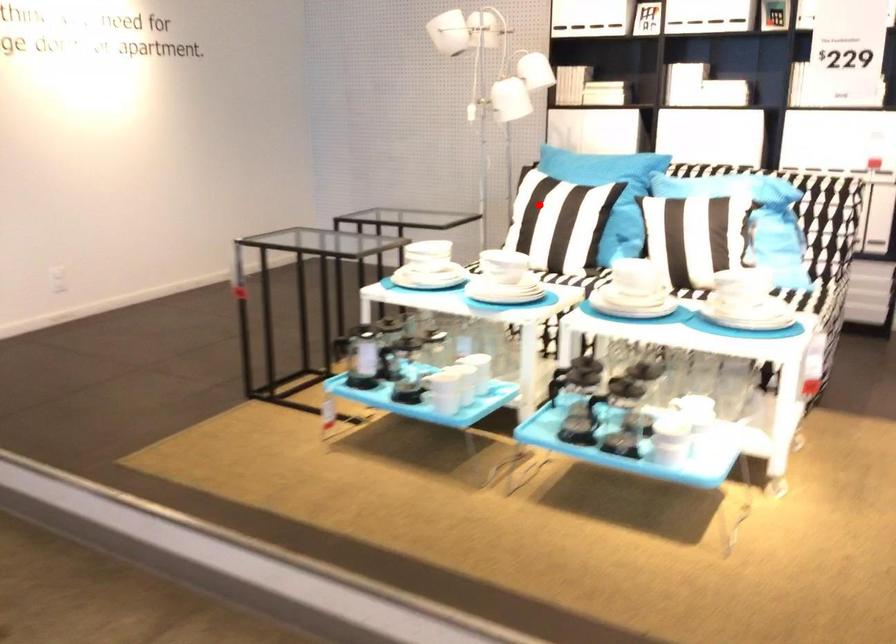
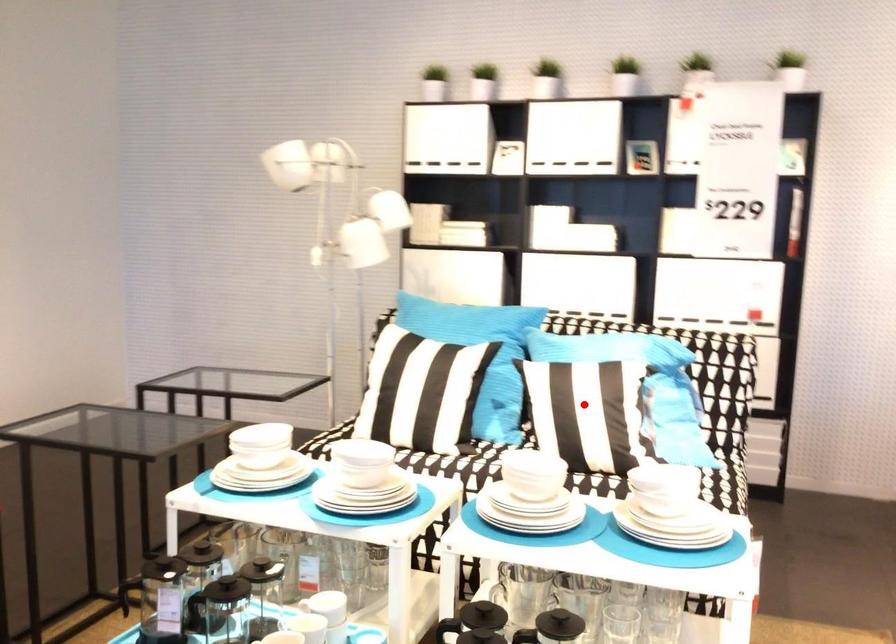
I am providing you with two images of the same scene from different viewpoints. A red point is marked on the first image and another point is marked on the second image. Do the highlighted points in image1 and image2 indicate the same real-world spot?

No